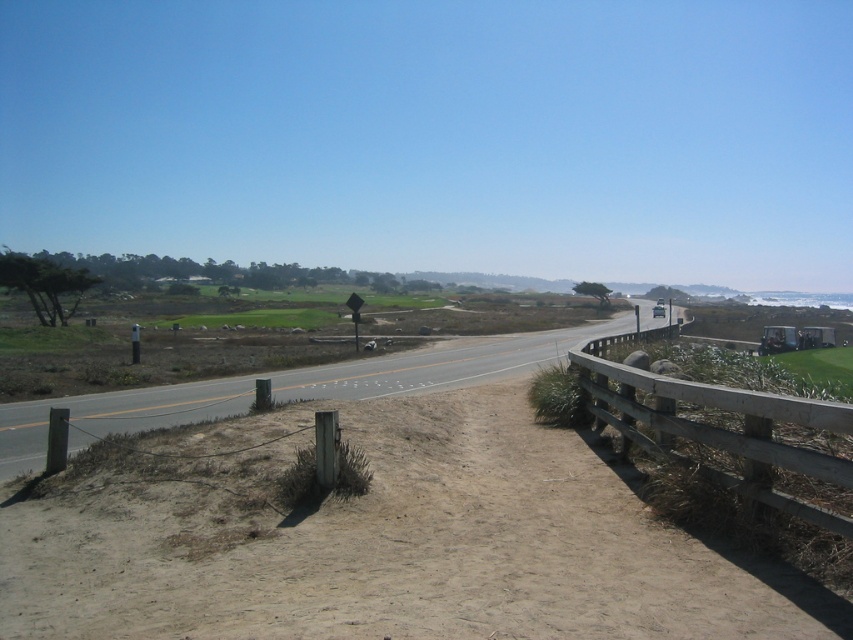
Can you confirm if wooden fence at right is positioned to the left of asphalt road at center?

Indeed, wooden fence at right is positioned on the left side of asphalt road at center.

Identify the location of wooden fence at right. This screenshot has width=853, height=640. (730, 452).

You are a GUI agent. You are given a task and a screenshot of the screen. Output one action in this format:
    pyautogui.click(x=<x>, y=<y>)
    Task: Click on the wooden fence at right
    This screenshot has height=640, width=853.
    Given the screenshot: What is the action you would take?
    pyautogui.click(x=730, y=452)